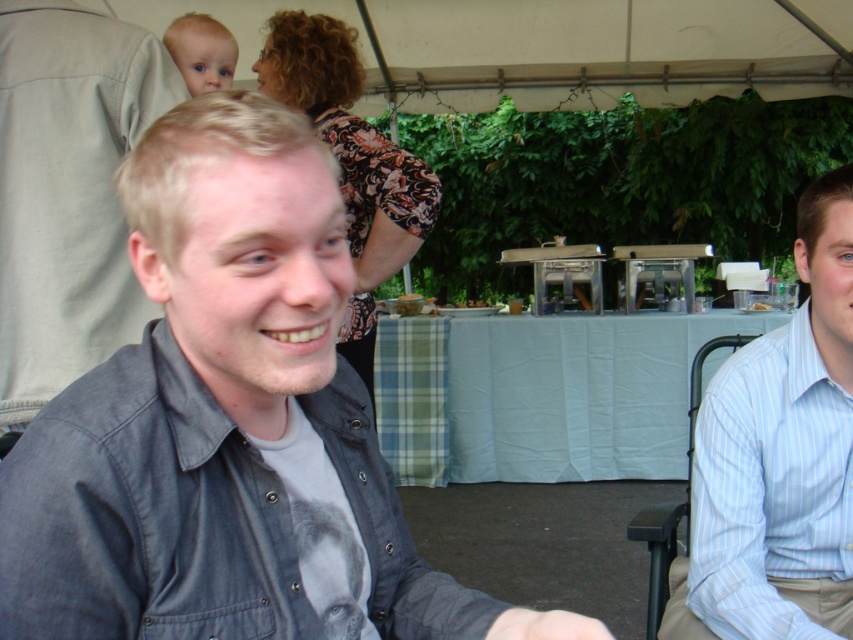
Looking at this image, is denim jacket at left positioned in front of green plaid fabric at center?

Yes, denim jacket at left is in front of green plaid fabric at center.

Is denim jacket at left positioned at the back of green plaid fabric at center?

No, denim jacket at left is closer to the viewer.

You are a GUI agent. You are given a task and a screenshot of the screen. Output one action in this format:
    pyautogui.click(x=<x>, y=<y>)
    Task: Click on the denim jacket at left
    
    Given the screenshot: What is the action you would take?
    pyautogui.click(x=68, y=192)

Is denim shirt at center thinner than green plaid fabric at center?

Indeed, denim shirt at center has a lesser width compared to green plaid fabric at center.

Can you confirm if denim shirt at center is smaller than green plaid fabric at center?

Yes.

Does point (323, 355) lie in front of point (593, 403)?

That is True.

Locate an element on the screen. Image resolution: width=853 pixels, height=640 pixels. denim shirt at center is located at coordinates (227, 426).

Which is more to the right, light blue striped shirt at right or denim jacket at left?

light blue striped shirt at right

Describe the element at coordinates (778, 460) in the screenshot. The image size is (853, 640). I see `light blue striped shirt at right` at that location.

The height and width of the screenshot is (640, 853). What do you see at coordinates (778, 460) in the screenshot? I see `light blue striped shirt at right` at bounding box center [778, 460].

In order to click on light blue striped shirt at right in this screenshot , I will do pyautogui.click(x=778, y=460).